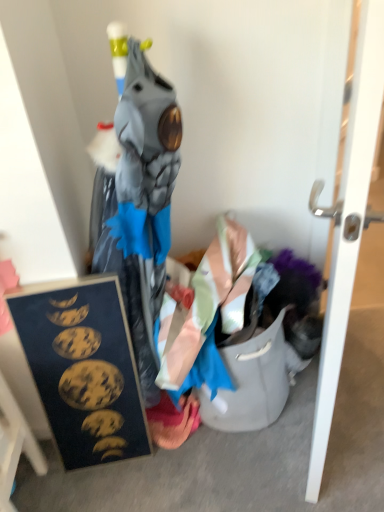
Image resolution: width=384 pixels, height=512 pixels. In order to click on vacant point to the right of wooden frame at lower left in this screenshot , I will do `click(70, 493)`.